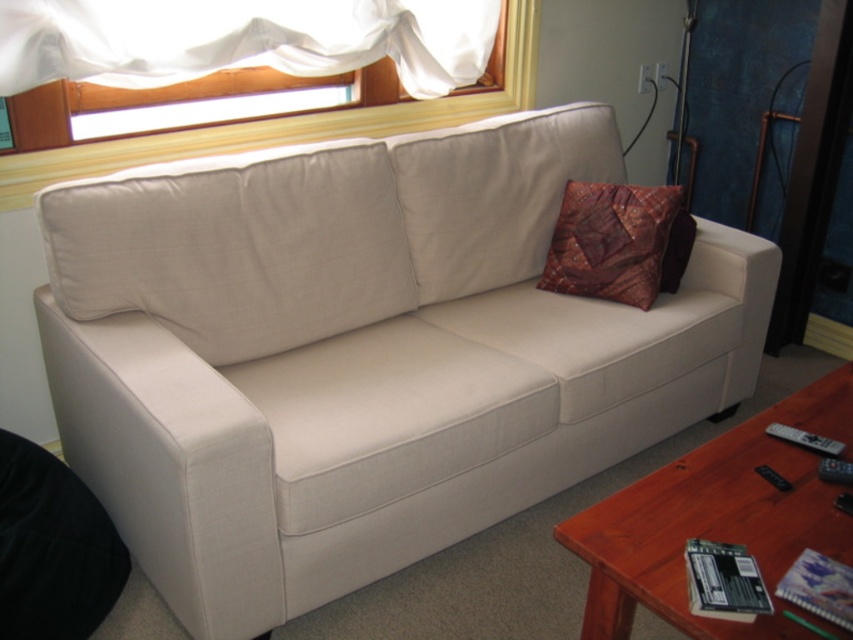
Question: Can you confirm if brown wood coffee table at lower right is bigger than white sheer curtain at upper left?

Choices:
 (A) yes
 (B) no

Answer: (B)

Question: Which point is closer to the camera?

Choices:
 (A) black matte card at lower right
 (B) white sheer curtain at upper left

Answer: (A)

Question: Which of these objects is positioned closest to the white sheer curtain at upper left?

Choices:
 (A) beige fabric couch at center
 (B) black matte card at lower right

Answer: (A)

Question: Observing the image, what is the correct spatial positioning of beige fabric couch at center in reference to brown wood coffee table at lower right?

Choices:
 (A) above
 (B) below

Answer: (A)

Question: Which point is closer to the camera?

Choices:
 (A) white sheer curtain at upper left
 (B) quilted silk pillow at center

Answer: (A)

Question: Can you confirm if brown wood coffee table at lower right is smaller than white sheer curtain at upper left?

Choices:
 (A) no
 (B) yes

Answer: (B)